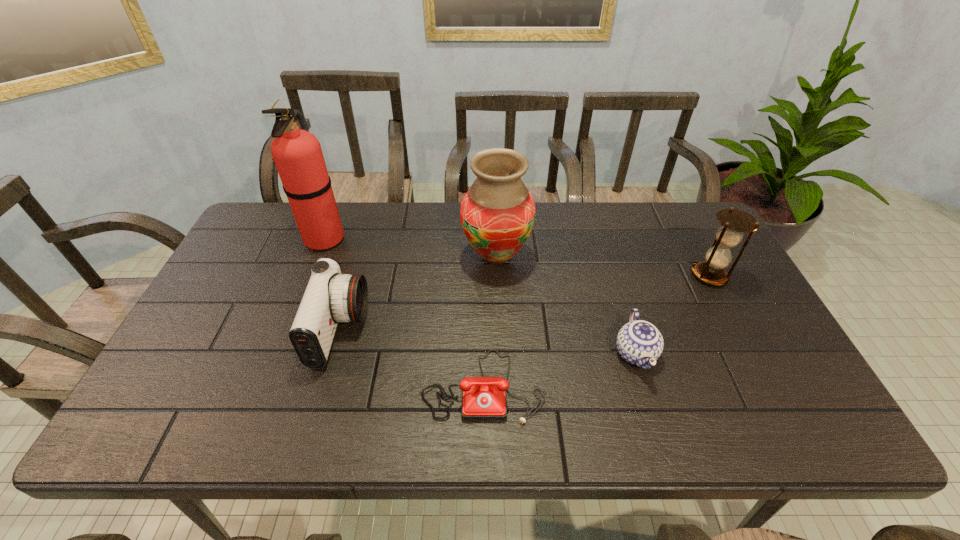
Find the location of a particular element. This screenshot has width=960, height=540. free location at the left edge is located at coordinates (263, 251).

This screenshot has height=540, width=960. I want to click on vacant space at the right edge of the desktop, so click(x=727, y=288).

This screenshot has height=540, width=960. I want to click on vacant space at the near left corner of the desktop, so click(199, 416).

At what (x,y) coordinates should I click in order to perform the action: click on free space at the far right corner. Please return your answer as a coordinate pair (x, y). Looking at the image, I should click on (685, 204).

The image size is (960, 540). I want to click on vacant space that is in between the rightmost object and the tallest object, so click(517, 256).

Find the location of a particular element. This screenshot has height=540, width=960. vacant area that lies between the telephone and the fire extinguisher is located at coordinates (404, 312).

Locate an element on the screen. Image resolution: width=960 pixels, height=540 pixels. unoccupied position between the second object from left to right and the fifth object from left to right is located at coordinates (488, 342).

Find the location of a particular element. This screenshot has height=540, width=960. empty location between the fire extinguisher and the hourglass is located at coordinates (517, 256).

This screenshot has height=540, width=960. I want to click on vacant space that's between the rightmost object and the third shortest object, so point(525,303).

Where is `free space between the leftmost object and the fifth tallest object`? free space between the leftmost object and the fifth tallest object is located at coordinates (480, 295).